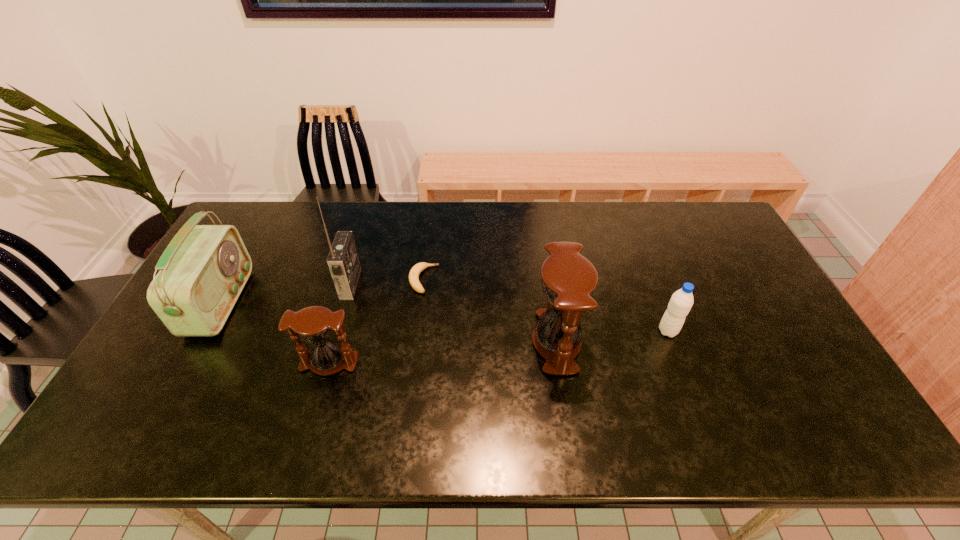
Please point a spot to add another hourglass on the right. Please provide its 2D coordinates. Your answer should be formatted as a tuple, i.e. [(x, y)], where the tuple contains the x and y coordinates of a point satisfying the conditions above.

[(766, 322)]